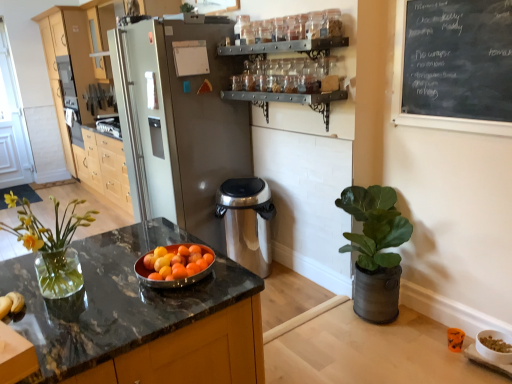
Locate an element on the screen. This screenshot has width=512, height=384. free space that is to the left of green matte plant at right is located at coordinates (312, 304).